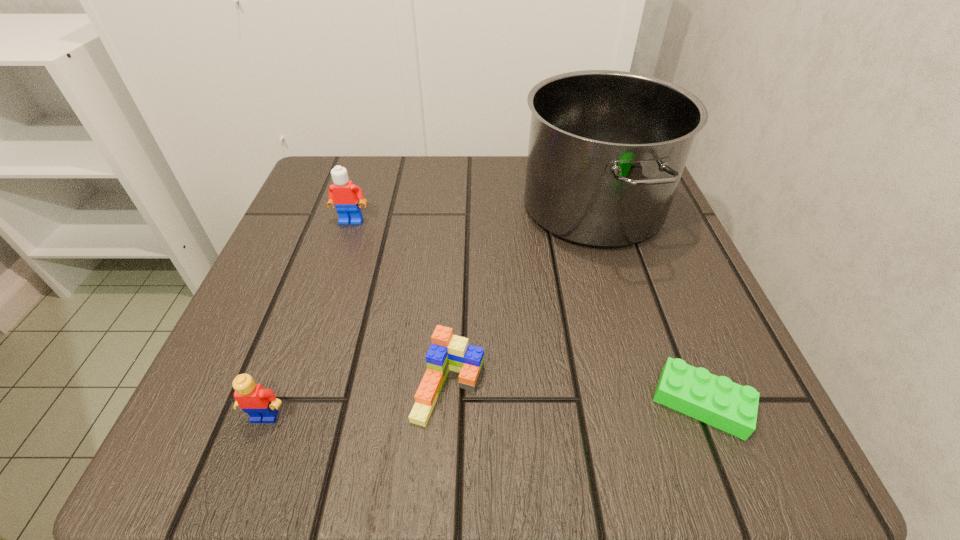
The width and height of the screenshot is (960, 540). Find the location of `vacant region at the far edge of the desktop`. vacant region at the far edge of the desktop is located at coordinates (521, 218).

Where is `free location at the near edge`? The image size is (960, 540). free location at the near edge is located at coordinates (529, 459).

Locate an element on the screen. vacant space at the left edge of the desktop is located at coordinates (231, 361).

At what (x,y) coordinates should I click in order to perform the action: click on blank space at the right edge of the desktop. Please return your answer as a coordinate pair (x, y). This screenshot has width=960, height=540. Looking at the image, I should click on (656, 301).

You are a GUI agent. You are given a task and a screenshot of the screen. Output one action in this format:
    pyautogui.click(x=<x>, y=<y>)
    Task: Click on the vacant space at the far left corner
    
    Given the screenshot: What is the action you would take?
    pyautogui.click(x=361, y=184)

Identify the location of vacant space at the near left corner of the desktop. The height and width of the screenshot is (540, 960). (293, 446).

What are the coordinates of `unoccupied position between the saucepan and the third tallest Lego` in the screenshot? It's located at (521, 298).

Where is `free space between the tallest Lego and the saucepan`? The height and width of the screenshot is (540, 960). free space between the tallest Lego and the saucepan is located at coordinates (472, 214).

The image size is (960, 540). Find the location of `vacant area that lies between the third shortest object and the farthest Lego`. vacant area that lies between the third shortest object and the farthest Lego is located at coordinates (308, 319).

Locate an element on the screen. The height and width of the screenshot is (540, 960). free space between the rightmost Lego and the third Lego from left to right is located at coordinates (575, 395).